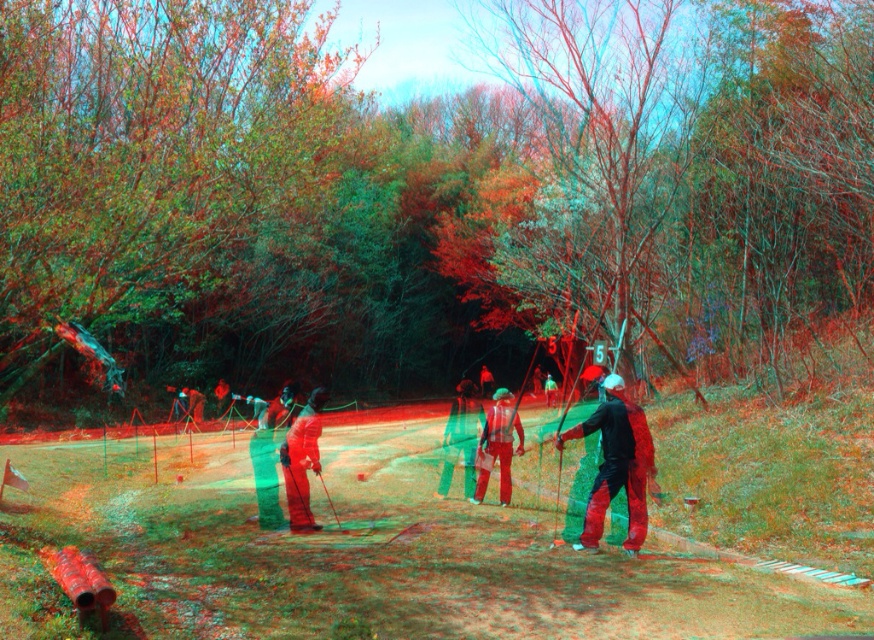
Does matte black jacket at center have a lesser height compared to red matte pants at center?

Incorrect, matte black jacket at center's height does not fall short of red matte pants at center's.

Does point (642, 412) come farther from viewer compared to point (494, 410)?

That is False.

You are a GUI agent. You are given a task and a screenshot of the screen. Output one action in this format:
    pyautogui.click(x=<x>, y=<y>)
    Task: Click on the matte black jacket at center
    
    Given the screenshot: What is the action you would take?
    pyautogui.click(x=616, y=465)

Who is more distant from viewer, (476, 433) or (551, 406)?

The point (551, 406) is behind.

This screenshot has height=640, width=874. What do you see at coordinates (461, 436) in the screenshot? I see `green fabric jacket at center` at bounding box center [461, 436].

Is point (481, 420) less distant than point (556, 387)?

Yes.

Locate an element on the screen. This screenshot has height=640, width=874. green fabric jacket at center is located at coordinates (461, 436).

Who is positioned more to the right, matte red pants at center or red matte pants at center?

Positioned to the right is red matte pants at center.

Is matte red pants at center further to the viewer compared to red matte pants at center?

No.

Between point (296, 440) and point (477, 492), which one is positioned in front?

Positioned in front is point (296, 440).

Image resolution: width=874 pixels, height=640 pixels. Find the location of `matte red pants at center`. matte red pants at center is located at coordinates (302, 460).